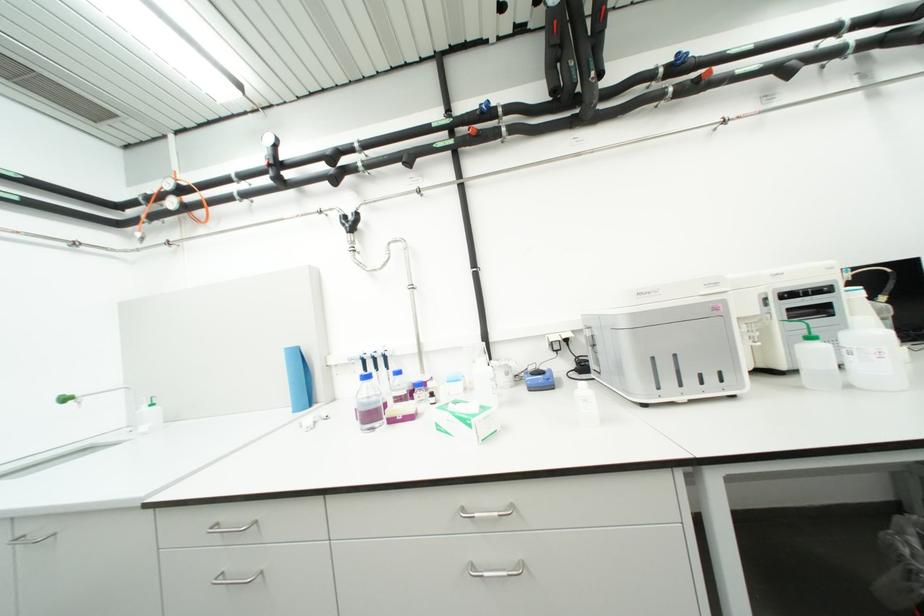
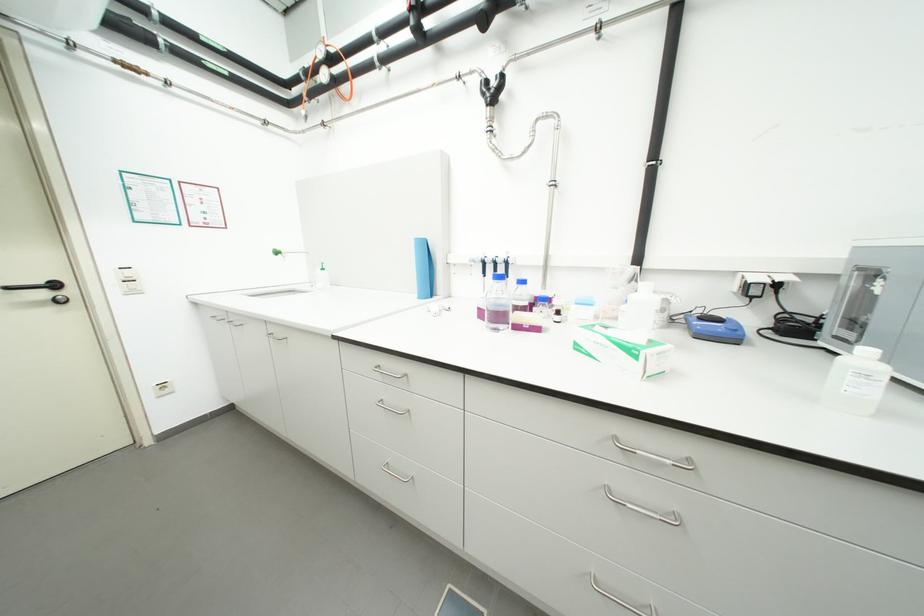
Consider the image. In a continuous first-person perspective shot, in which direction is the camera moving?

The cameraman walked toward left, forward.